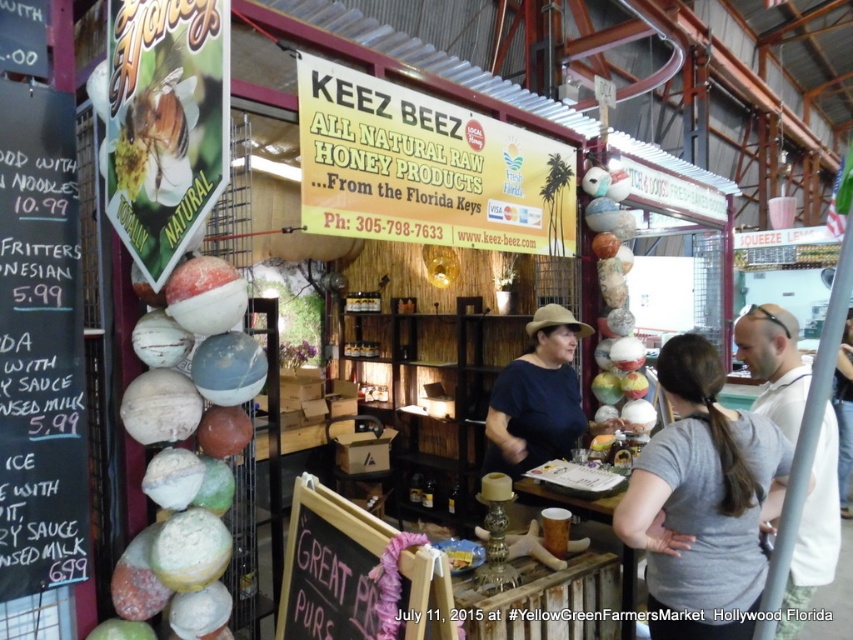
Question: Can you confirm if black chalkboard menu at left is positioned above gray cotton shirt at center?

Choices:
 (A) yes
 (B) no

Answer: (A)

Question: Does black chalkboard menu at left have a smaller size compared to light gray t-shirt at right?

Choices:
 (A) no
 (B) yes

Answer: (B)

Question: Which object is the farthest from the gray fabric shirt at center?

Choices:
 (A) black chalkboard menu at left
 (B) light gray t-shirt at right

Answer: (A)

Question: Is light gray t-shirt at right above gray fabric shirt at center?

Choices:
 (A) no
 (B) yes

Answer: (B)

Question: Which point is farther to the camera?

Choices:
 (A) gray cotton shirt at center
 (B) light gray t-shirt at right
 (C) gray fabric shirt at center

Answer: (C)

Question: Which point is farther from the camera taking this photo?

Choices:
 (A) (793, 346)
 (B) (718, 556)
 (C) (82, 451)

Answer: (A)